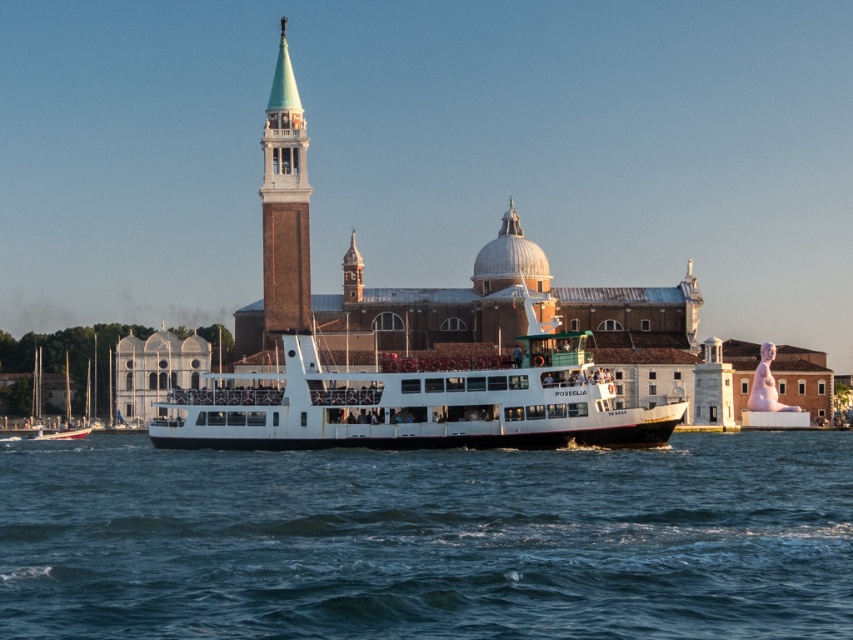
You are standing at the point marked as point (280, 272) and want to walk towards the point marked as point (523, 464). Which direction should you move to get closer to your destination?

To move from point (280, 272) towards point (523, 464), you should move northeast since point (523, 464) is northeast of point (280, 272).

You are standing on the deck of the ferry boat Poveglia and want to take a photo of the historic building complex in the background. To ensure the blue water at center is in the frame, where should you position your camera relative to the ferry?

The blue water at center is located at point (428, 540), so position your camera towards the center of the ferry deck to include the blue water at center in the photo.

You are standing on the deck of the large white ferry boat named Poveglia and looking towards the point marked at coordinates (428, 540). What do you see there?

At the coordinates (428, 540), you see blue water at center.